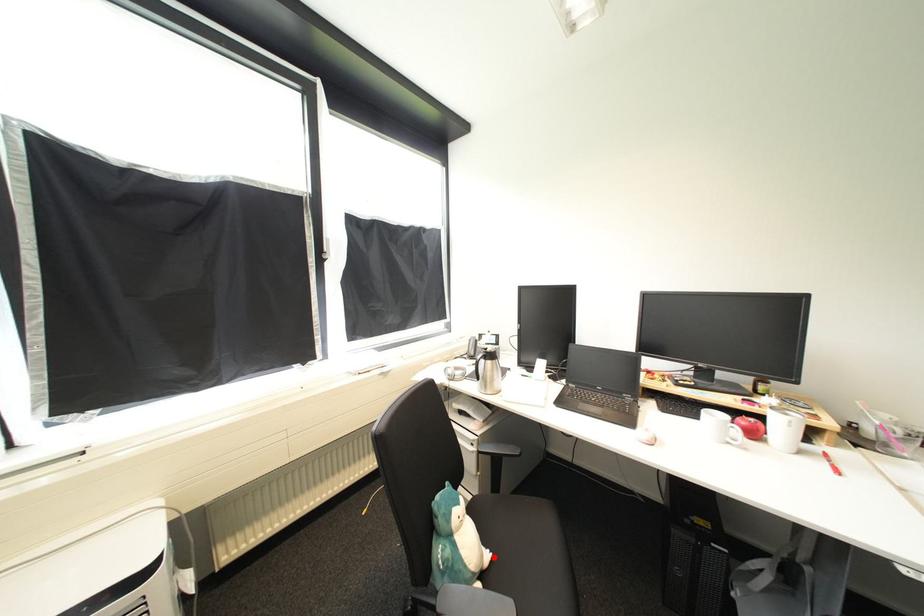
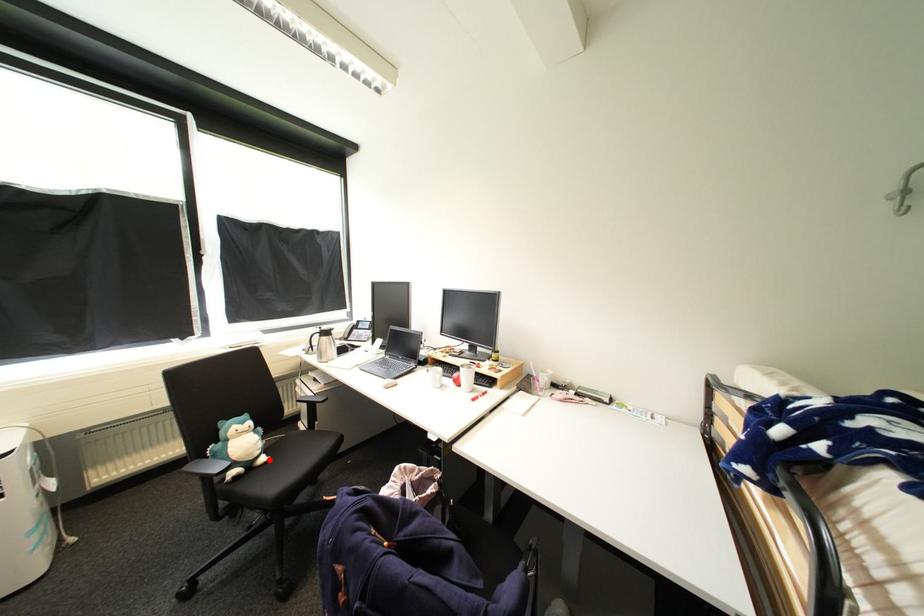
I am providing you with two images of the same scene from different viewpoints. A red point is marked on the first image and another point is marked on the second image. Do the highlighted points in image1 and image2 indicate the same real-world spot?

Yes